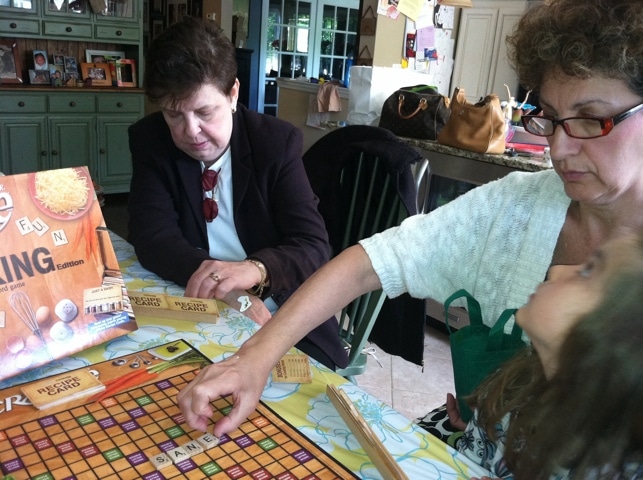
Identify the location of yellow part of table cloth. This screenshot has height=480, width=643. (287, 408).